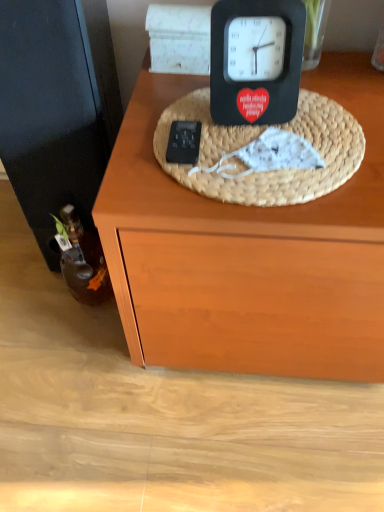
Where is `vacant area that is situated to the right of black matte clock at upper center`? vacant area that is situated to the right of black matte clock at upper center is located at coordinates (326, 117).